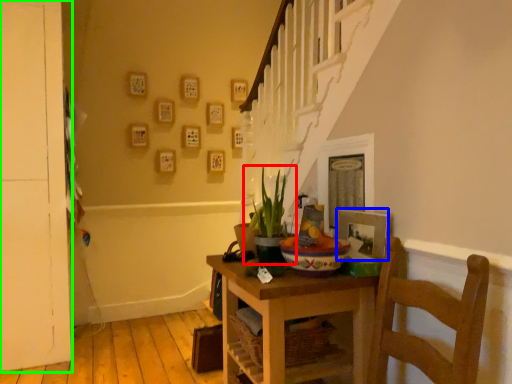
Question: Based on their relative distances, which object is farther from houseplant (highlighted by a red box)? Choose from picture frame (highlighted by a blue box) and door (highlighted by a green box).

Choices:
 (A) picture frame
 (B) door

Answer: (B)